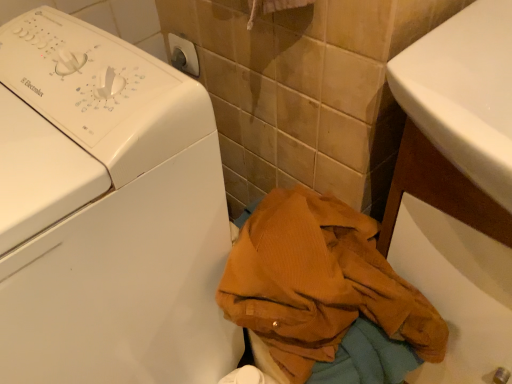
What are the coordinates of `white plastic washing machine at lower left` in the screenshot? It's located at (106, 215).

The image size is (512, 384). What do you see at coordinates (106, 215) in the screenshot? I see `white plastic washing machine at lower left` at bounding box center [106, 215].

What is the approximate height of white plastic washing machine at lower left?

The height of white plastic washing machine at lower left is 35.43 inches.

Where is `corduroy fabric jacket at lower right`? Image resolution: width=512 pixels, height=384 pixels. corduroy fabric jacket at lower right is located at coordinates (325, 296).

The image size is (512, 384). What do you see at coordinates (325, 296) in the screenshot? I see `corduroy fabric jacket at lower right` at bounding box center [325, 296].

Where is `white plastic washing machine at lower left`? The height and width of the screenshot is (384, 512). white plastic washing machine at lower left is located at coordinates (106, 215).

Is corduroy fabric jacket at lower right at the left side of white plastic washing machine at lower left?

In fact, corduroy fabric jacket at lower right is to the right of white plastic washing machine at lower left.

Is corduroy fabric jacket at lower right in front of white plastic washing machine at lower left?

No.

Does point (314, 374) come closer to viewer compared to point (33, 176)?

No.

From the image's perspective, would you say corduroy fabric jacket at lower right is shown under white plastic washing machine at lower left?

Yes, from the image's perspective, corduroy fabric jacket at lower right is beneath white plastic washing machine at lower left.

From a real-world perspective, between corduroy fabric jacket at lower right and white plastic washing machine at lower left, who is vertically lower?

corduroy fabric jacket at lower right is physically lower.

Which of these two, corduroy fabric jacket at lower right or white plastic washing machine at lower left, is thinner?

With smaller width is corduroy fabric jacket at lower right.

In terms of height, does corduroy fabric jacket at lower right look taller or shorter compared to white plastic washing machine at lower left?

corduroy fabric jacket at lower right is shorter than white plastic washing machine at lower left.

Is corduroy fabric jacket at lower right bigger than white plastic washing machine at lower left?

No, corduroy fabric jacket at lower right is not bigger than white plastic washing machine at lower left.

Would you say corduroy fabric jacket at lower right is outside white plastic washing machine at lower left?

Yes, corduroy fabric jacket at lower right is outside of white plastic washing machine at lower left.

Is corduroy fabric jacket at lower right in contact with white plastic washing machine at lower left?

No, corduroy fabric jacket at lower right is not touching white plastic washing machine at lower left.

Is corduroy fabric jacket at lower right looking in the opposite direction of white plastic washing machine at lower left?

No, corduroy fabric jacket at lower right is not facing away from white plastic washing machine at lower left.

How different are the orientations of corduroy fabric jacket at lower right and white plastic washing machine at lower left in degrees?

The angular difference between corduroy fabric jacket at lower right and white plastic washing machine at lower left is 0.000271 degrees.

The width and height of the screenshot is (512, 384). Find the location of `washing machine above the corduroy fabric jacket at lower right (from the image's perspective)`. washing machine above the corduroy fabric jacket at lower right (from the image's perspective) is located at coordinates (106, 215).

Considering the relative positions of white plastic washing machine at lower left and corduroy fabric jacket at lower right in the image provided, is white plastic washing machine at lower left to the right of corduroy fabric jacket at lower right from the viewer's perspective?

No.

Who is more distant, white plastic washing machine at lower left or corduroy fabric jacket at lower right?

corduroy fabric jacket at lower right.

Which is closer to the camera, (151, 89) or (267, 275)?

The point (151, 89) is closer to the camera.

From the image's perspective, which object appears higher, white plastic washing machine at lower left or corduroy fabric jacket at lower right?

white plastic washing machine at lower left appears higher in the image.

From a real-world perspective, which is physically above, white plastic washing machine at lower left or corduroy fabric jacket at lower right?

From a 3D spatial view, white plastic washing machine at lower left is above.

Does white plastic washing machine at lower left have a greater width compared to corduroy fabric jacket at lower right?

Yes, white plastic washing machine at lower left is wider than corduroy fabric jacket at lower right.

Is white plastic washing machine at lower left taller or shorter than corduroy fabric jacket at lower right?

white plastic washing machine at lower left is taller than corduroy fabric jacket at lower right.

Which of these two, white plastic washing machine at lower left or corduroy fabric jacket at lower right, is bigger?

white plastic washing machine at lower left.

Can we say white plastic washing machine at lower left lies outside corduroy fabric jacket at lower right?

white plastic washing machine at lower left lies outside corduroy fabric jacket at lower right's area.

Are white plastic washing machine at lower left and corduroy fabric jacket at lower right beside each other?

There is a gap between white plastic washing machine at lower left and corduroy fabric jacket at lower right.

Is white plastic washing machine at lower left looking in the opposite direction of corduroy fabric jacket at lower right?

No, white plastic washing machine at lower left is not facing away from corduroy fabric jacket at lower right.

Can you tell me how much white plastic washing machine at lower left and corduroy fabric jacket at lower right differ in facing direction?

The angular difference between white plastic washing machine at lower left and corduroy fabric jacket at lower right is 0.000271 degrees.

Identify the location of clothing lying on the right of white plastic washing machine at lower left. (325, 296).

Find the location of a particular element. washing machine that appears above the corduroy fabric jacket at lower right (from the image's perspective) is located at coordinates (106, 215).

Find the location of `clothing on the right of white plastic washing machine at lower left`. clothing on the right of white plastic washing machine at lower left is located at coordinates (325, 296).